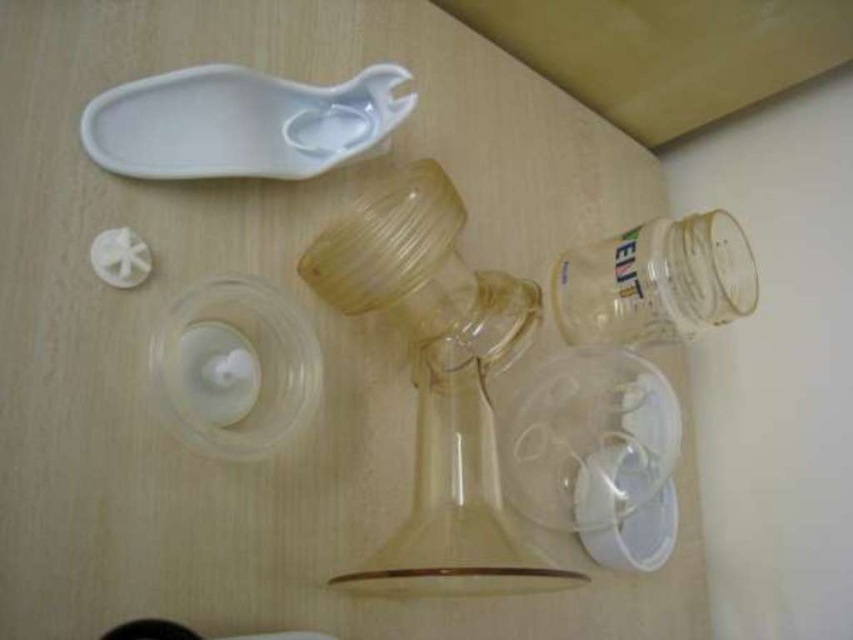
Is translucent plastic glass vase at center smaller than transparent plastic jar at lower right?

No, translucent plastic glass vase at center is not smaller than transparent plastic jar at lower right.

What do you see at coordinates (436, 381) in the screenshot? Image resolution: width=853 pixels, height=640 pixels. I see `translucent plastic glass vase at center` at bounding box center [436, 381].

Which is behind, point (390, 304) or point (590, 323)?

The point (590, 323) is behind.

Identify the location of translucent plastic glass vase at center. (436, 381).